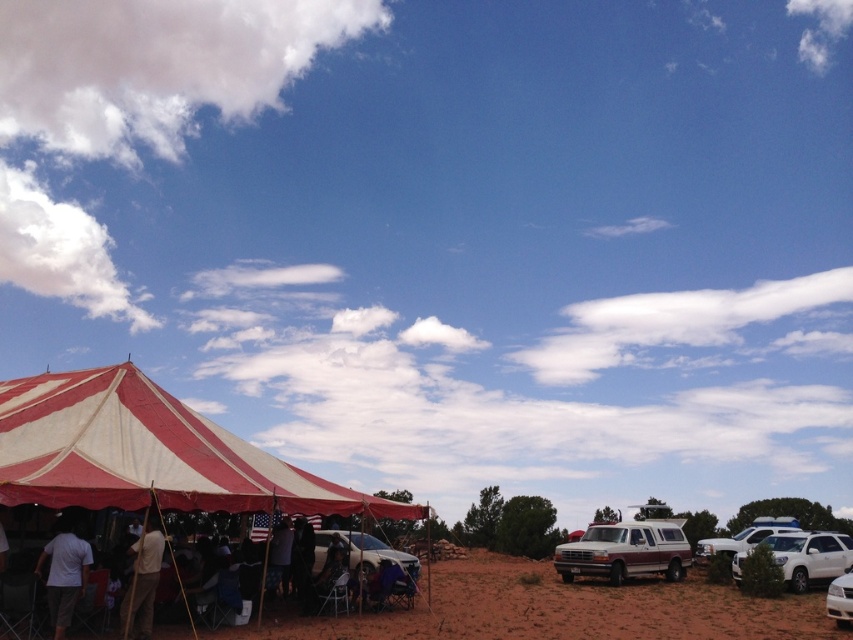
Question: Based on their relative distances, which object is farther from the white glossy sedan at lower right?

Choices:
 (A) dark gray fabric at center
 (B) rustic wood pickup truck at lower right

Answer: (A)

Question: Is red and white striped tent at lower left wider than white matte suv at lower right?

Choices:
 (A) yes
 (B) no

Answer: (A)

Question: Which object is farther from the camera taking this photo?

Choices:
 (A) white matte suv at lower right
 (B) white matte police car at right

Answer: (B)

Question: Where is white cotton shirt at lower left located in relation to dark gray fabric at center in the image?

Choices:
 (A) right
 (B) left

Answer: (B)

Question: Which of these objects is positioned closest to the white cotton shirt at lower left?

Choices:
 (A) rustic wood pickup truck at lower right
 (B) light brown fabric tent pole at lower left
 (C) white glossy sedan at lower right
 (D) white matte police car at right

Answer: (B)

Question: Can you confirm if red and white striped tent at lower left is positioned below dark gray fabric at center?

Choices:
 (A) no
 (B) yes

Answer: (A)